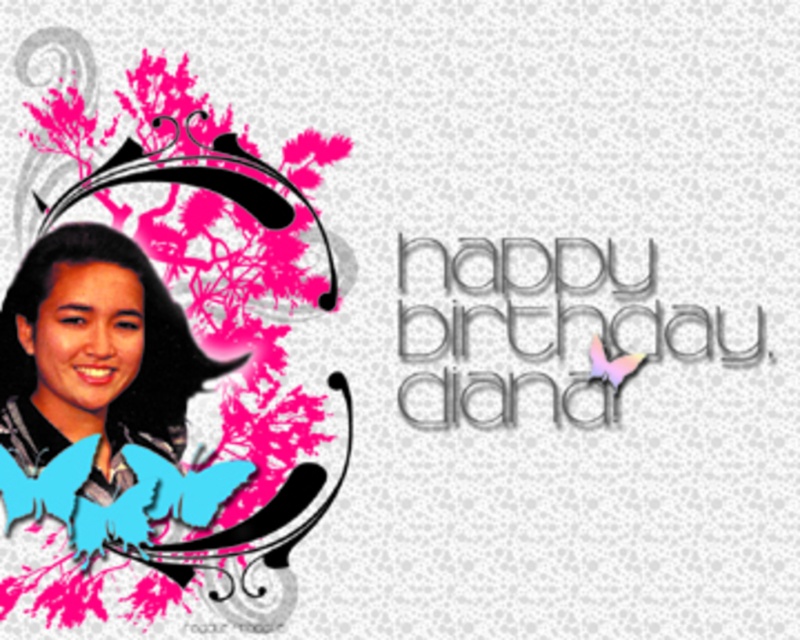
You are designing a birthday card and want to ensure the metallic silver text at center is prominent. Given that it is closer to the viewer than the matte black hair at left, how does its positioning affect visibility?

The metallic silver text at center is positioned closer to the viewer than the matte black hair at left, making it stand out more and ensuring it is the first thing noticed on the card.

You are designing a birthday card and want to place a sticker at coordinate point 0.661, 0.255. Which object from the matte black portrait at left is at that location?

The matte black portrait at left is located at point (204, 422), so placing the sticker there would place it directly on the matte black portrait at left.